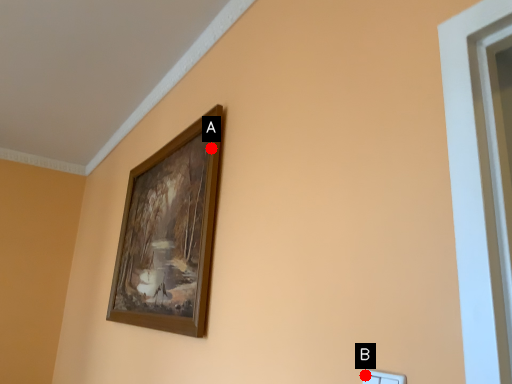
Question: Two points are circled on the image, labeled by A and B beside each circle. Which of the following is the closest to the observer?

Choices:
 (A) A is closer
 (B) B is closer

Answer: (B)